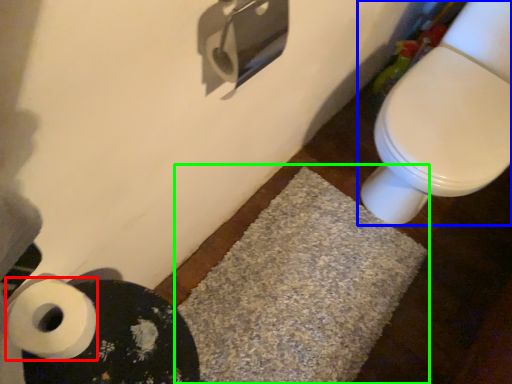
Question: Considering the real-world distances, which object is farthest from toilet paper (highlighted by a red box)? toilet (highlighted by a blue box) or bath mat (highlighted by a green box)?

Choices:
 (A) toilet
 (B) bath mat

Answer: (A)